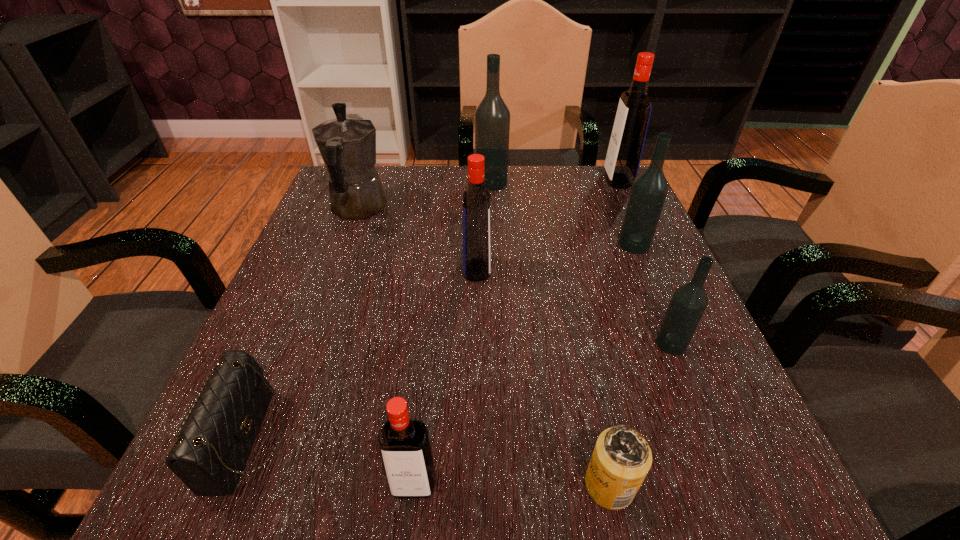
Identify the location of vacant position located 0.070m on the pouring side of the coffeepot. This screenshot has height=540, width=960. (372, 172).

Image resolution: width=960 pixels, height=540 pixels. What are the coordinates of `vacant space located 0.120m on the front of the second nearest black vodka` in the screenshot? It's located at (656, 295).

At what (x,y) coordinates should I click in order to perform the action: click on free region located 0.240m on the front and back of the fifth farthest object. Please return your answer as a coordinate pair (x, y). Looking at the image, I should click on (612, 270).

Identify the location of vacant space situated on the front of the nearest black vodka. (728, 481).

I want to click on vacant area situated 0.390m on the back of the beer can, so click(x=563, y=268).

At what (x,y) coordinates should I click in order to perform the action: click on vacant area situated 0.110m on the front flap of the clutch bag. Please return your answer as a coordinate pair (x, y). The image size is (960, 540). Looking at the image, I should click on (361, 440).

Locate an element on the screen. The image size is (960, 540). coffeepot that is positioned at the far edge is located at coordinates (347, 144).

Locate an element on the screen. vodka that is positioned at the near edge is located at coordinates (404, 444).

Where is `beer can located in the near edge section of the desktop`? The image size is (960, 540). beer can located in the near edge section of the desktop is located at coordinates (621, 459).

This screenshot has width=960, height=540. I want to click on clutch bag present at the near edge, so click(x=209, y=455).